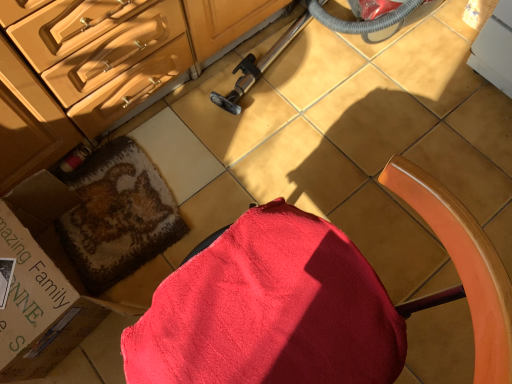
Question: Does red cotton bath towel at lower left lie in front of cardboard box at lower left?

Choices:
 (A) yes
 (B) no

Answer: (B)

Question: Does red cotton bath towel at lower left appear on the right side of cardboard box at lower left?

Choices:
 (A) no
 (B) yes

Answer: (B)

Question: Would you say red cotton bath towel at lower left contains cardboard box at lower left?

Choices:
 (A) no
 (B) yes

Answer: (A)

Question: Is red cotton bath towel at lower left facing towards cardboard box at lower left?

Choices:
 (A) yes
 (B) no

Answer: (B)

Question: From the image's perspective, is red cotton bath towel at lower left above cardboard box at lower left?

Choices:
 (A) yes
 (B) no

Answer: (A)

Question: From a real-world perspective, is red cotton bath towel at lower left beneath cardboard box at lower left?

Choices:
 (A) yes
 (B) no

Answer: (A)

Question: Is red fabric chair at center shorter than red cotton bath towel at lower left?

Choices:
 (A) no
 (B) yes

Answer: (A)

Question: Is the surface of red fabric chair at center in direct contact with red cotton bath towel at lower left?

Choices:
 (A) yes
 (B) no

Answer: (B)

Question: From the image's perspective, would you say red fabric chair at center is positioned over red cotton bath towel at lower left?

Choices:
 (A) no
 (B) yes

Answer: (A)

Question: Does red fabric chair at center have a lesser width compared to red cotton bath towel at lower left?

Choices:
 (A) yes
 (B) no

Answer: (B)

Question: From a real-world perspective, is red fabric chair at center physically below red cotton bath towel at lower left?

Choices:
 (A) no
 (B) yes

Answer: (A)

Question: Considering the relative sizes of red fabric chair at center and red cotton bath towel at lower left in the image provided, is red fabric chair at center taller than red cotton bath towel at lower left?

Choices:
 (A) no
 (B) yes

Answer: (B)

Question: Could you tell me if cardboard box at lower left is facing red fabric chair at center?

Choices:
 (A) no
 (B) yes

Answer: (A)